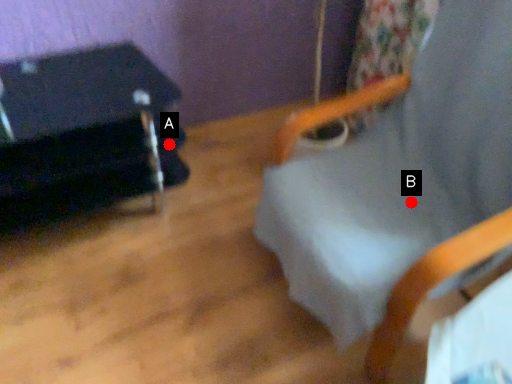
Question: Two points are circled on the image, labeled by A and B beside each circle. Which point is further to the camera?

Choices:
 (A) A is further
 (B) B is further

Answer: (A)